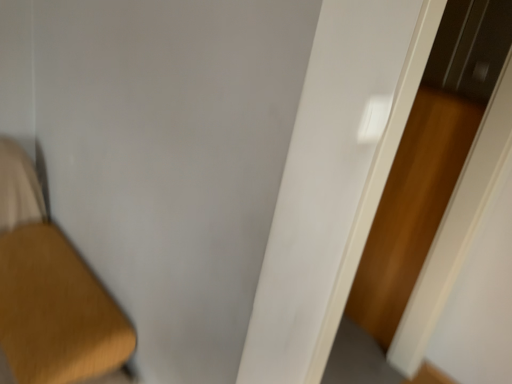
Question: From a real-world perspective, relative to wooden screen door at right, is white glossy door at center vertically above or below?

Choices:
 (A) above
 (B) below

Answer: (A)

Question: Does point (309, 177) appear closer or farther from the camera than point (356, 291)?

Choices:
 (A) closer
 (B) farther

Answer: (A)

Question: Do you think white glossy door at center is within wooden screen door at right, or outside of it?

Choices:
 (A) inside
 (B) outside

Answer: (B)

Question: From the image's perspective, relative to white glossy door at center, is wooden screen door at right above or below?

Choices:
 (A) above
 (B) below

Answer: (A)

Question: Is wooden screen door at right bigger or smaller than white glossy door at center?

Choices:
 (A) big
 (B) small

Answer: (B)

Question: Is wooden screen door at right in front of or behind white glossy door at center in the image?

Choices:
 (A) front
 (B) behind

Answer: (B)

Question: Is wooden screen door at right to the left or to the right of white glossy door at center in the image?

Choices:
 (A) right
 (B) left

Answer: (A)